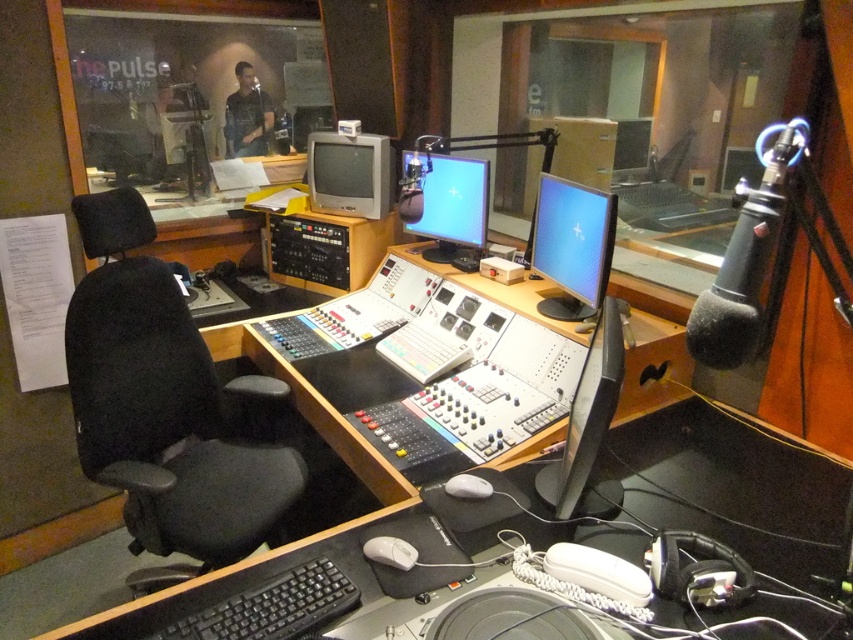
Based on the photo, you are a technician in the radio station control room. You need to place a new device that requires 20 cm of space. The device is as wide as the white matte mouse at center. Can the matte black monitor at center accommodate the space needed for the new device?

The matte black monitor at center has a larger width than the white matte mouse at center, so the new device, which is as wide as the white matte mouse at center, can fit in the space allocated for the matte black monitor at center.

You are a sound engineer in the radio station control room. You need to adjust two points on the desk. The first point is at coordinate point (263, 488) and the second is at point (354, 602). Which point is closer to you?

Point (263, 488) is further to the viewer than point (354, 602). Therefore, point (354, 602) is closer to you.